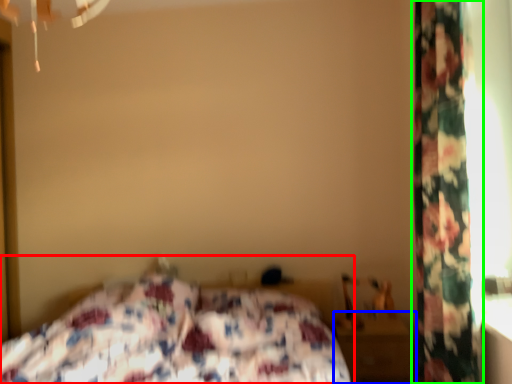
Question: Estimate the real-world distances between objects in this image. Which object is farther from bed (highlighted by a red box), nightstand (highlighted by a blue box) or curtain (highlighted by a green box)?

Choices:
 (A) nightstand
 (B) curtain

Answer: (B)